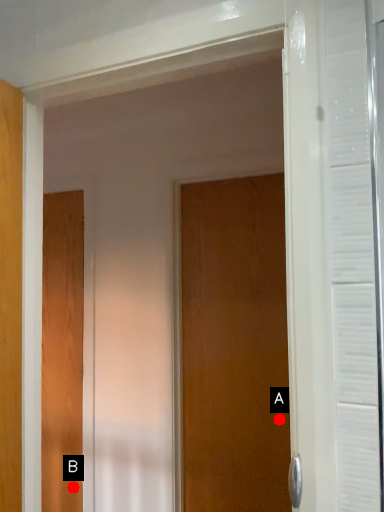
Question: Two points are circled on the image, labeled by A and B beside each circle. Which point is farther to the camera?

Choices:
 (A) A is further
 (B) B is further

Answer: (B)